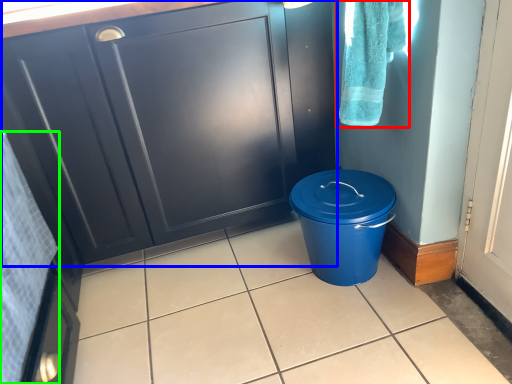
Question: Estimate the real-world distances between objects in this image. Which object is farther from bath towel (highlighted by a red box), cabinetry (highlighted by a blue box) or bath towel (highlighted by a green box)?

Choices:
 (A) cabinetry
 (B) bath towel

Answer: (B)